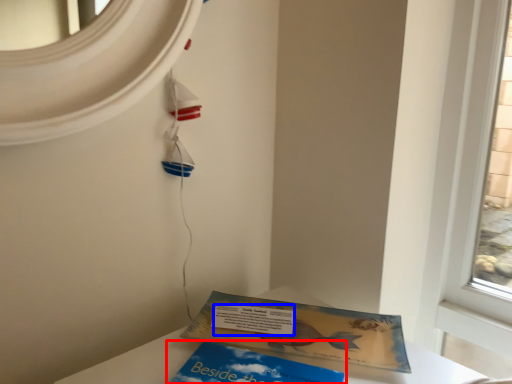
Question: Which object appears farthest to the camera in this image, book (highlighted by a red box) or writing (highlighted by a blue box)?

Choices:
 (A) book
 (B) writing

Answer: (B)